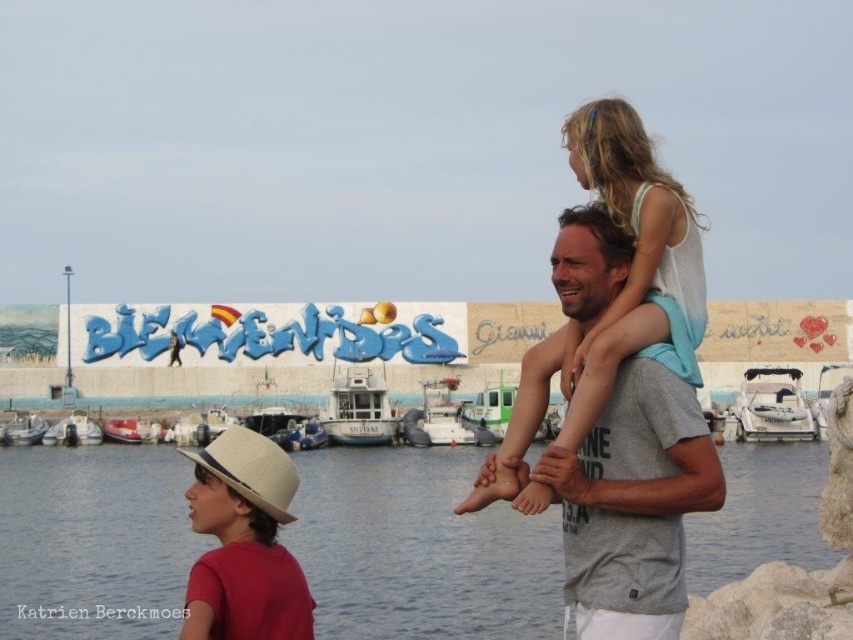
Question: In this image, where is gray cotton t-shirt at center located relative to beige straw hat at upper right?

Choices:
 (A) above
 (B) below

Answer: (A)

Question: Among these points, which one is farthest from the camera?

Choices:
 (A) (201, 596)
 (B) (602, 435)
 (C) (78, 589)

Answer: (C)

Question: Does clear water at lower center have a smaller size compared to gray cotton t-shirt at center?

Choices:
 (A) yes
 (B) no

Answer: (B)

Question: Which of the following is the farthest from the observer?

Choices:
 (A) (677, 540)
 (B) (68, 492)
 (C) (267, 550)

Answer: (B)

Question: Which of the following is the farthest from the observer?

Choices:
 (A) (558, 497)
 (B) (231, 461)

Answer: (B)

Question: Observing the image, what is the correct spatial positioning of clear water at lower center in reference to gray cotton t-shirt at center?

Choices:
 (A) above
 (B) below

Answer: (B)